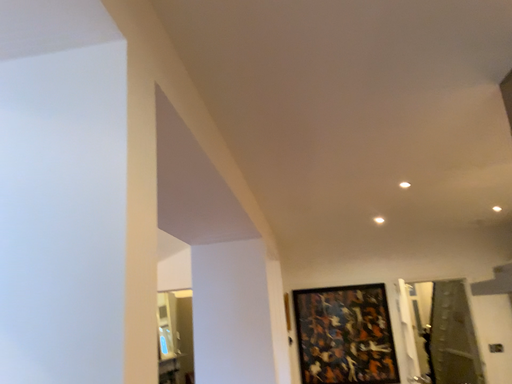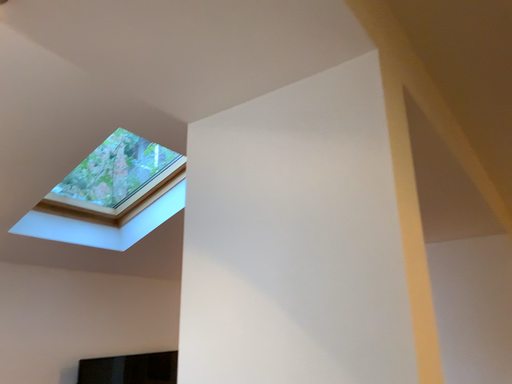
Question: Which way did the camera rotate in the video?

Choices:
 (A) rotated right
 (B) rotated left

Answer: (B)